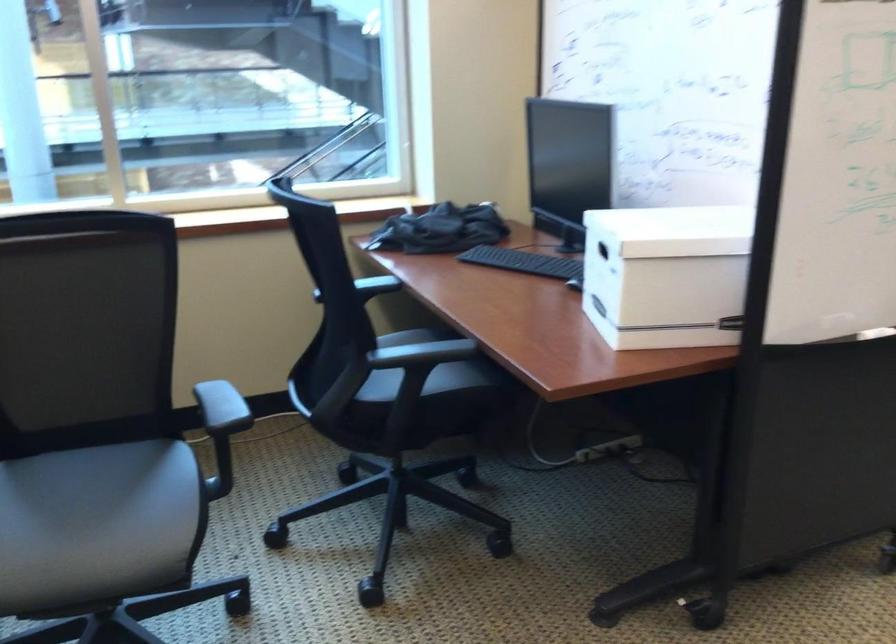
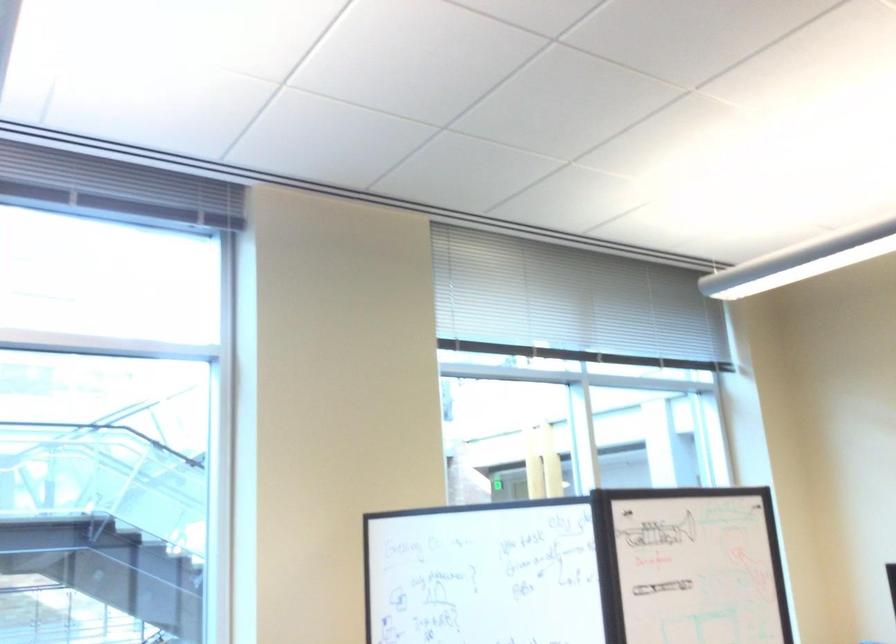
The first image is from the beginning of the video and the second image is from the end. How did the camera likely rotate when shooting the video?

The camera rotated toward right-up.